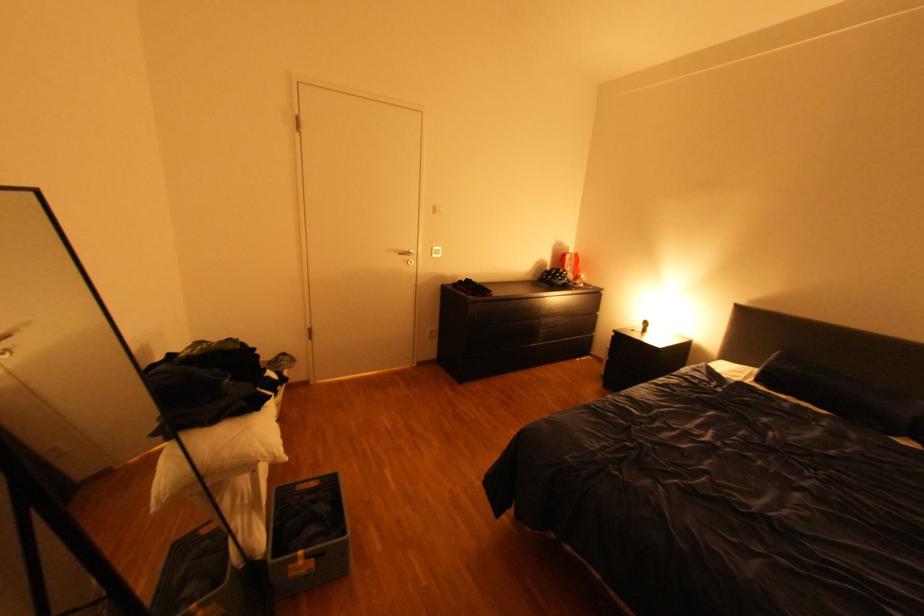
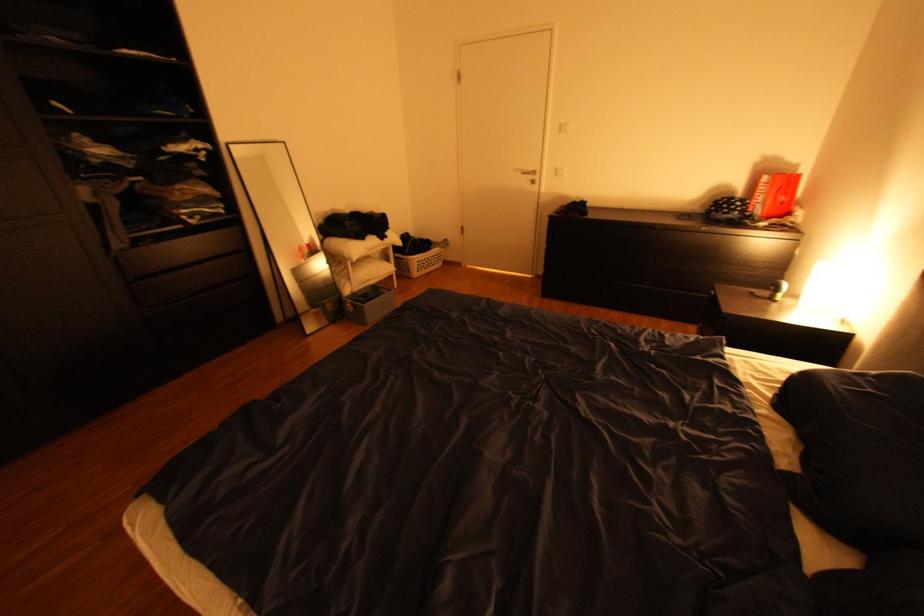
Where in the second image is the point corresponding to pixel 354 533 from the first image?

(373, 304)